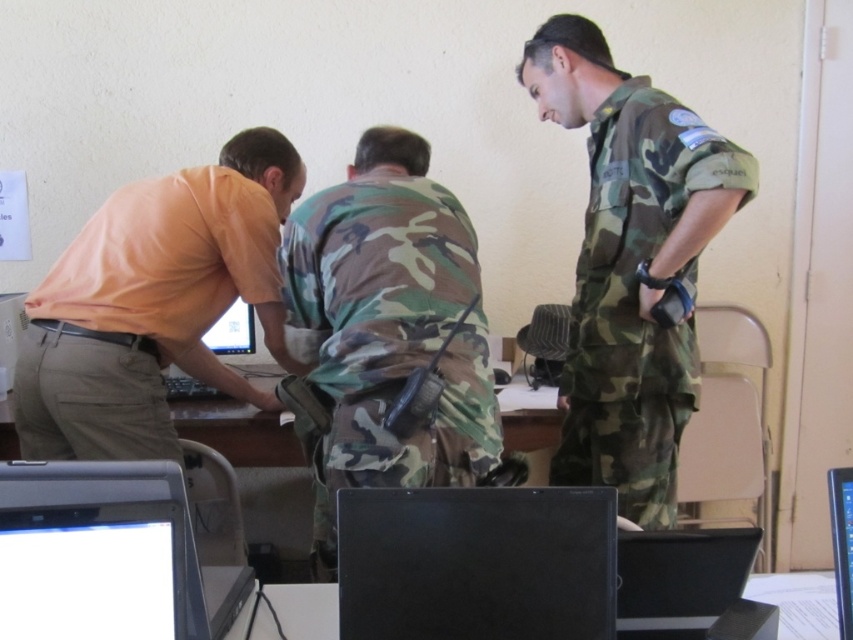
You are a person trying to sit at the black plastic table at lower center. The camo fabric uniform at center is currently occupying the space. Can you still sit at the table?

The camo fabric uniform at center is wider than the black plastic table at lower center, so it might block access to the table. You may need to move the uniform to sit there.

You are trying to place a new keyboard between the black matte laptop at center and the black glossy laptop at lower center. Can you fit it there?

The black matte laptop at center occupies less space than the black glossy laptop at lower center, so there might be enough space to fit a keyboard between them, but it depends on the keyboard size and the exact distance between the two laptops.

Where is the camo fabric uniform at center located in the image?

The camo fabric uniform at center is located at point (384, 339) in the image.